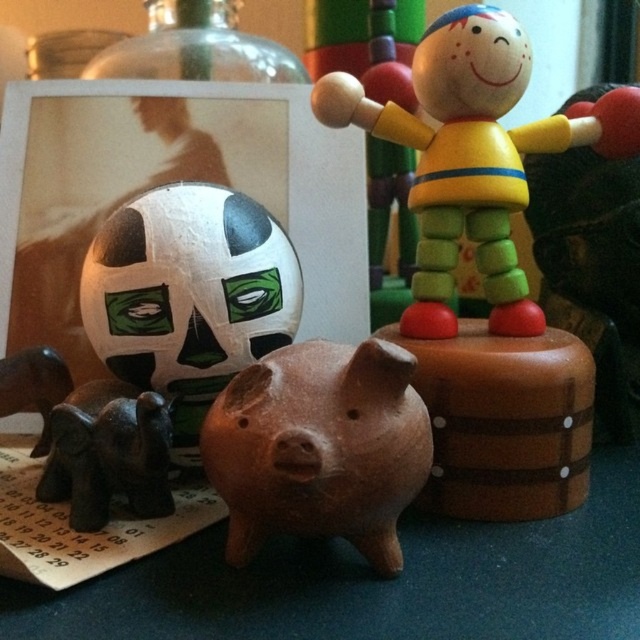
You are a toy collector examining the arrangement of items on the dark surface. You notice a wooden barrel to the right of the pig and two elephants to the left. Where is the wooden figure marked by point (474, 156) located in relation to these items?

The wooden figure marked by point (474, 156) is located at the upper right of the scene, above both the wooden barrel to the right of the pig and the two elephants to the left.

Consider the image. You are organizing a display and need to place the dark brown wooden elephant at lower left and the transparent glass bottle at upper left into a narrow shelf. Which object should you place first to ensure they both fit side by side?

You should place the dark brown wooden elephant at lower left first because it is thinner than the transparent glass bottle at upper left, allowing more space for the wider bottle afterward.

You are a collector organizing a display. You have to decide whether to place a new item between the dark brown wooden elephant at lower left and the transparent glass bottle at upper left. Based on their positions, can you place the new item there without overlapping them?

The dark brown wooden elephant at lower left is in front of the transparent glass bottle at upper left, so placing a new item between them would require positioning it either behind the elephant or in front of the bottle. Since they are not overlapping, there is space between them for the new item as long as it is placed appropriately in the z axis depth.